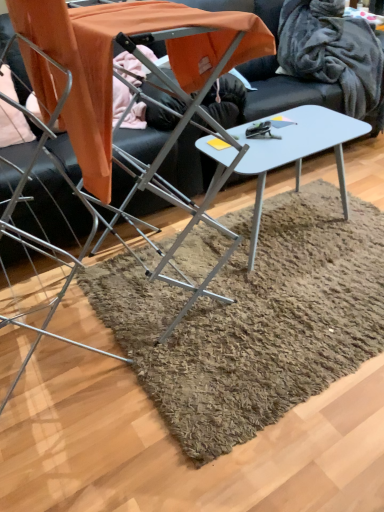
Question: From the image's perspective, is light gray plastic table at center, the 1th table when ordered from back to front, located above or below metallic silver chair at left?

Choices:
 (A) below
 (B) above

Answer: (A)

Question: From a real-world perspective, relative to metallic silver chair at left, is light gray plastic table at center, the 1th table when ordered from back to front, vertically above or below?

Choices:
 (A) below
 (B) above

Answer: (A)

Question: Which object is the closest to the velvety gray blanket at upper right?

Choices:
 (A) light gray plastic table at center, the 1th table when ordered from back to front
 (B) metallic silver chair at left
 (C) metallic gray table at center, the 1th table from the front

Answer: (A)

Question: Considering the real-world distances, which object is farthest from the metallic gray table at center, the 1th table from the front?

Choices:
 (A) metallic silver chair at left
 (B) velvety gray blanket at upper right
 (C) light gray plastic table at center, the 1th table when ordered from back to front

Answer: (B)